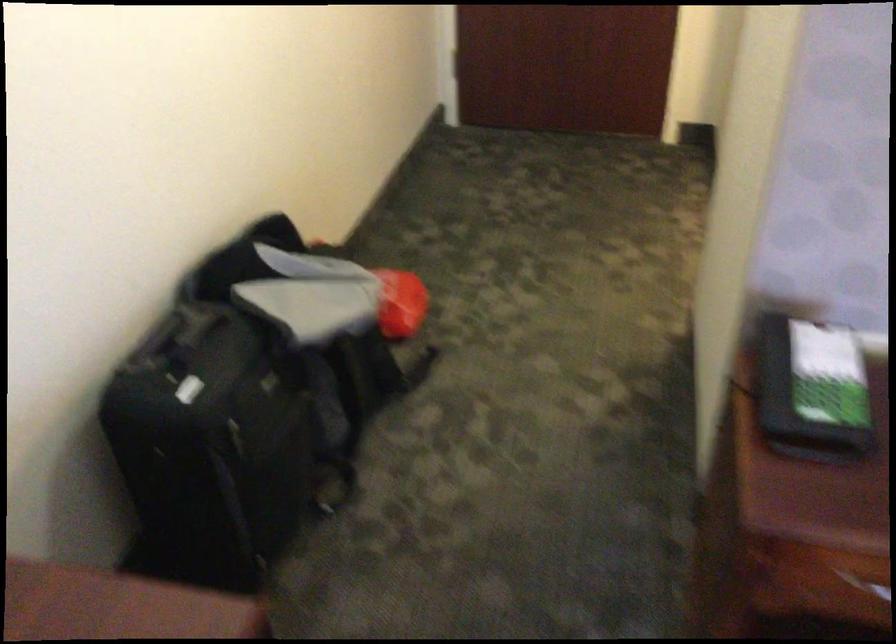
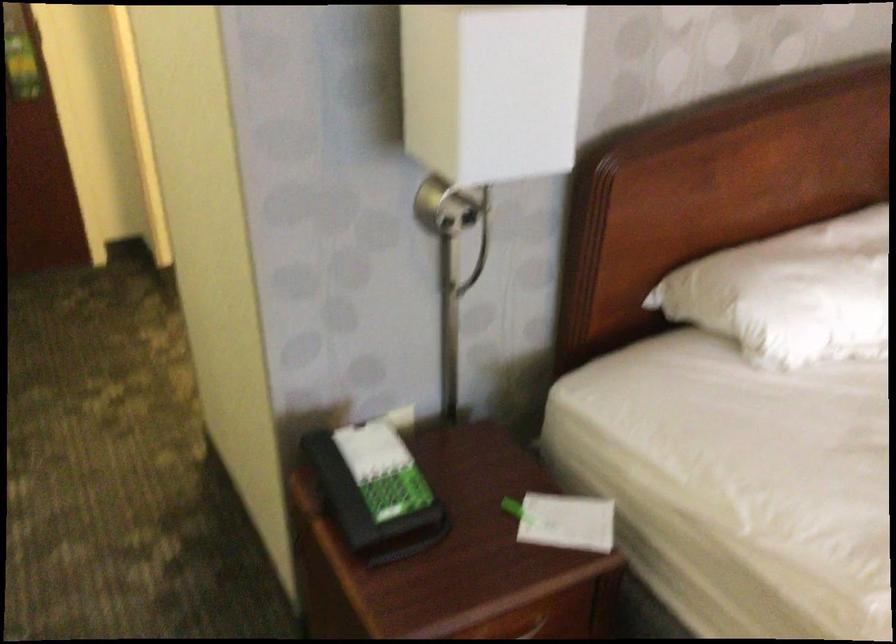
Find the pixel in the second image that matches (x=805, y=381) in the first image.

(375, 491)